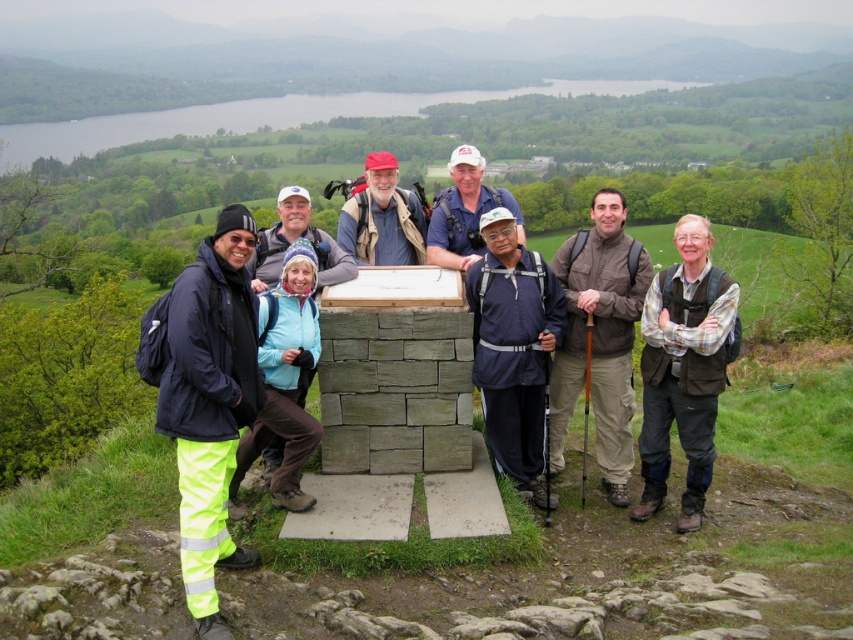
From the picture: Between matte red cap at center and white fabric cap at center, which one is positioned lower?

white fabric cap at center

Who is positioned more to the left, matte red cap at center or white fabric cap at center?

From the viewer's perspective, matte red cap at center appears more on the left side.

Where is `matte red cap at center`? The image size is (853, 640). matte red cap at center is located at coordinates tap(381, 218).

This screenshot has height=640, width=853. Identify the location of matte red cap at center. (381, 218).

Between point (567, 422) and point (300, 316), which one is positioned in front?

Positioned in front is point (300, 316).

Based on the photo, how far apart are brown fabric jacket at center and blue fleece jacket at center?

7.82 feet

Locate an element on the screen. brown fabric jacket at center is located at coordinates (599, 339).

What do you see at coordinates (285, 380) in the screenshot?
I see `blue fleece jacket at center` at bounding box center [285, 380].

This screenshot has height=640, width=853. What are the coordinates of `blue fleece jacket at center` in the screenshot? It's located at (285, 380).